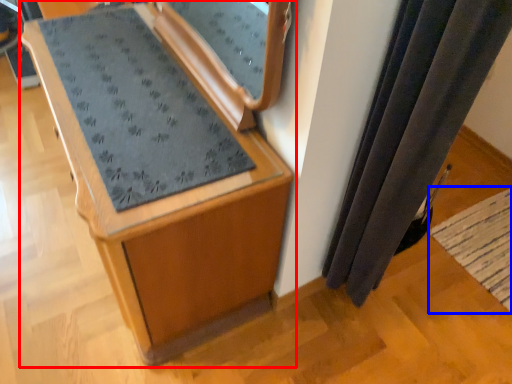
Question: Which object appears closest to the camera in this image, furniture (highlighted by a red box) or mat (highlighted by a blue box)?

Choices:
 (A) furniture
 (B) mat

Answer: (A)